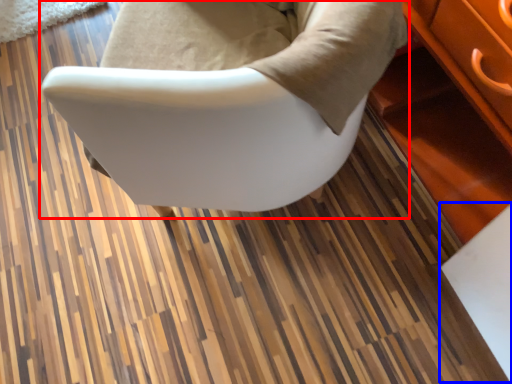
Question: Among these objects, which one is farthest to the camera, chair (highlighted by a red box) or table (highlighted by a blue box)?

Choices:
 (A) chair
 (B) table

Answer: (B)